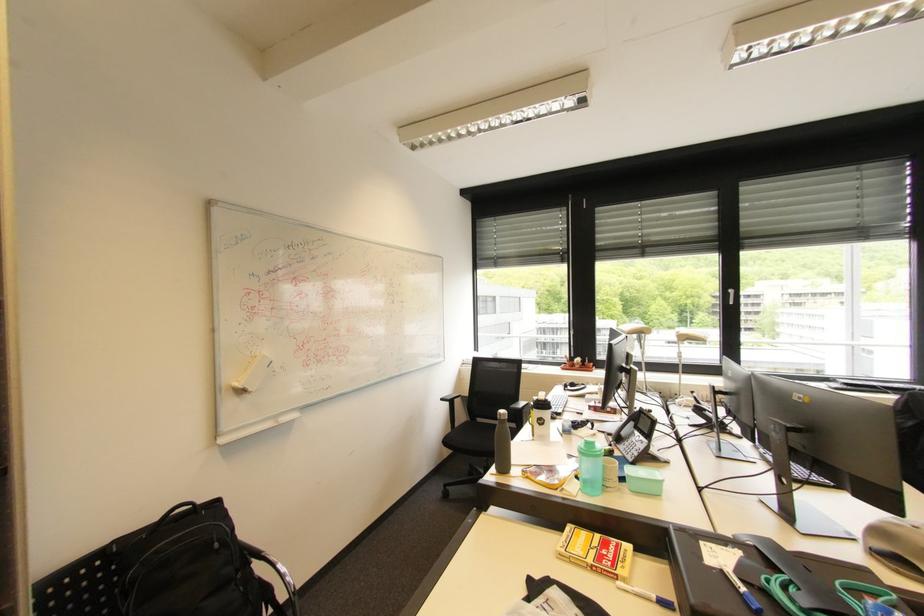
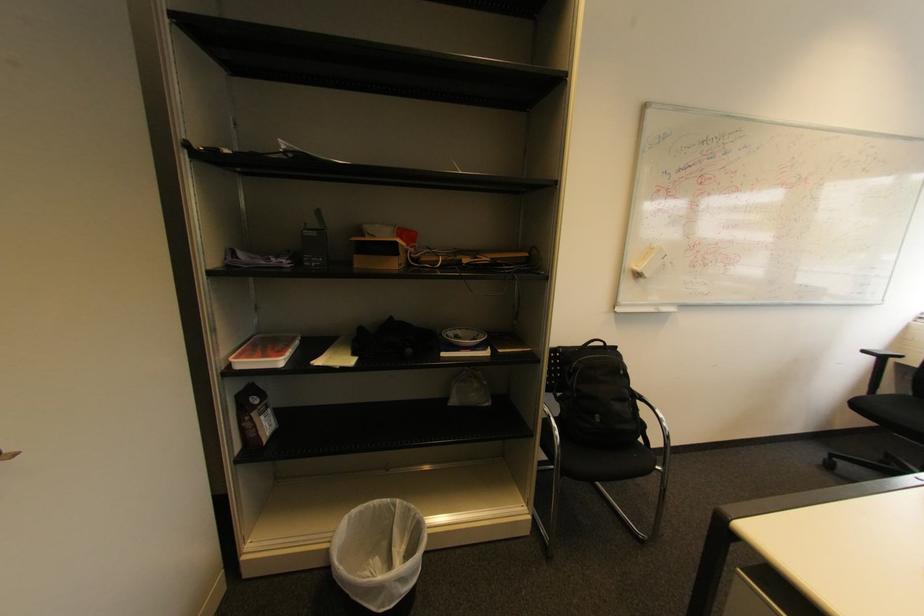
Question: Based on the continuous images, in which direction is the camera rotating? Reply with the corresponding letter.

Choices:
 (A) Left
 (B) Right
 (C) Up
 (D) Down

Answer: (A)